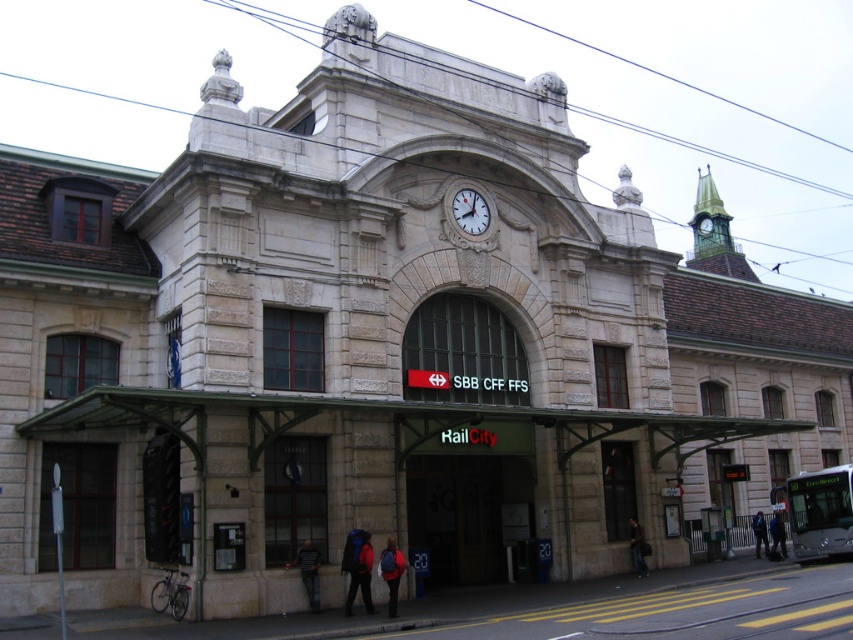
Does stone railway station at center appear on the right side of matte glass door at center?

Yes, stone railway station at center is to the right of matte glass door at center.

Based on the photo, which of these two, stone railway station at center or matte glass door at center, stands shorter?

Standing shorter between the two is matte glass door at center.

Which is behind, point (39, 432) or point (283, 467)?

The point (283, 467) is behind.

I want to click on stone railway station at center, so click(x=369, y=410).

Is point (596, 432) positioned after point (480, 196)?

No, it is not.

Which is behind, point (201, 609) or point (467, 218)?

Positioned behind is point (467, 218).

Which is behind, point (408, 422) or point (469, 202)?

The point (469, 202) is behind.

This screenshot has width=853, height=640. Identify the location of stone railway station at center. (369, 410).

Who is more forward, (x=370, y=568) or (x=640, y=564)?

Point (x=370, y=568) is in front.

Between matte black backpack at lower center and dark blue backpack at center, which one appears on the left side from the viewer's perspective?

Positioned to the left is matte black backpack at lower center.

You are a GUI agent. You are given a task and a screenshot of the screen. Output one action in this format:
    pyautogui.click(x=<x>, y=<y>)
    Task: Click on the matte black backpack at lower center
    The image size is (853, 640).
    Given the screenshot: What is the action you would take?
    pyautogui.click(x=357, y=568)

Image resolution: width=853 pixels, height=640 pixels. Identify the location of matte black backpack at lower center. (357, 568).